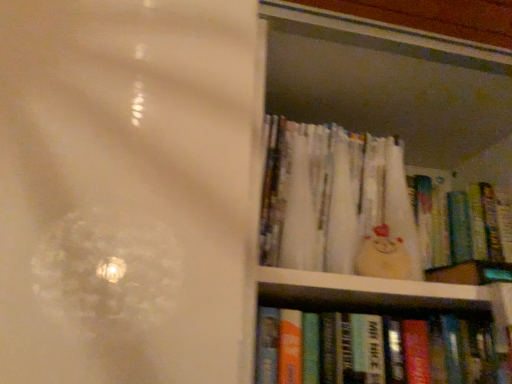
Question: From the image's perspective, does hardcover books at right appear higher than white paper book at upper right, which is the 1th book in top-to-bottom order?

Choices:
 (A) no
 (B) yes

Answer: (A)

Question: Does hardcover books at right touch white paper book at upper right, the 3th book positioned from the bottom?

Choices:
 (A) no
 (B) yes

Answer: (B)

Question: Is hardcover books at right taller than white paper book at upper right, the 3th book positioned from the bottom?

Choices:
 (A) yes
 (B) no

Answer: (A)

Question: Does hardcover books at right have a smaller size compared to white paper book at upper right, the 3th book positioned from the bottom?

Choices:
 (A) yes
 (B) no

Answer: (B)

Question: Can you confirm if hardcover books at right is wider than white paper book at upper right, the 3th book positioned from the bottom?

Choices:
 (A) no
 (B) yes

Answer: (B)

Question: In the image, is hardcover book at lower right, which is the first book from bottom to top, on the left side or the right side of white paper book at upper right, the 3th book positioned from the bottom?

Choices:
 (A) right
 (B) left

Answer: (A)

Question: Is hardcover book at lower right, the 3th book viewed from the top, inside the boundaries of white paper book at upper right, the 3th book positioned from the bottom, or outside?

Choices:
 (A) outside
 (B) inside

Answer: (A)

Question: Is hardcover book at lower right, the 3th book viewed from the top, in front of or behind white paper book at upper right, which is the 1th book in top-to-bottom order, in the image?

Choices:
 (A) behind
 (B) front

Answer: (B)

Question: Is hardcover book at lower right, the 3th book viewed from the top, bigger or smaller than white paper book at upper right, which is the 1th book in top-to-bottom order?

Choices:
 (A) big
 (B) small

Answer: (B)

Question: Looking at the image, does white paper book at upper right, which is the 1th book in top-to-bottom order, seem bigger or smaller compared to hardcover books at right?

Choices:
 (A) big
 (B) small

Answer: (B)

Question: From a real-world perspective, relative to hardcover books at right, is white paper book at upper right, the 3th book positioned from the bottom, vertically above or below?

Choices:
 (A) above
 (B) below

Answer: (A)

Question: In the image, is white paper book at upper right, the 3th book positioned from the bottom, positioned in front of or behind hardcover books at right?

Choices:
 (A) behind
 (B) front

Answer: (A)

Question: Considering the positions of white paper book at upper right, the 3th book positioned from the bottom, and hardcover books at right in the image, is white paper book at upper right, the 3th book positioned from the bottom, wider or thinner than hardcover books at right?

Choices:
 (A) thin
 (B) wide

Answer: (A)

Question: In terms of width, does hardcover books at right look wider or thinner when compared to white paper book at upper right, which is the 1th book in top-to-bottom order?

Choices:
 (A) wide
 (B) thin

Answer: (A)

Question: Relative to white paper book at upper right, the 3th book positioned from the bottom, is hardcover books at right in front or behind?

Choices:
 (A) front
 (B) behind

Answer: (A)